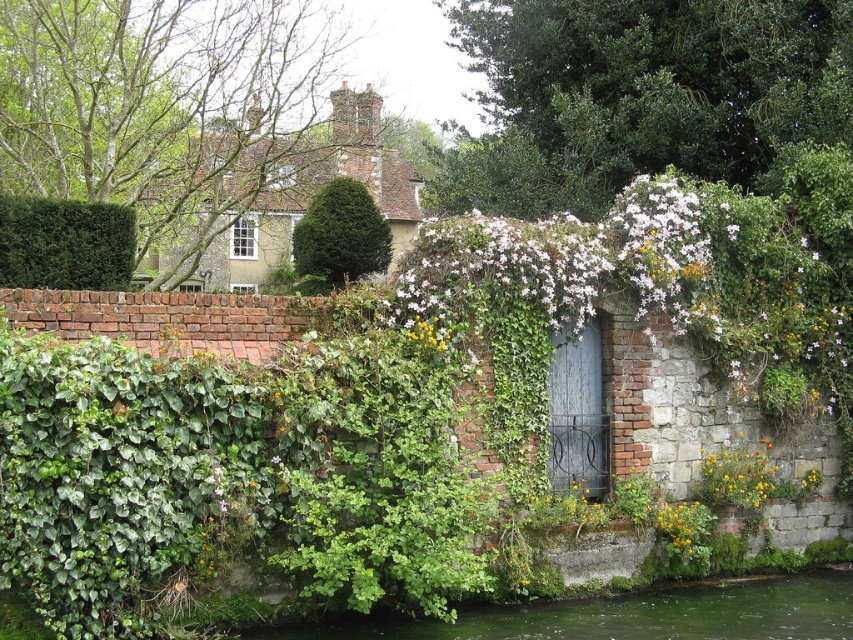
Question: Observing the image, what is the correct spatial positioning of white matte flowers at center in reference to green mossy stone at lower center?

Choices:
 (A) right
 (B) left

Answer: (B)

Question: Can you confirm if white matte flowers at center is bigger than green mossy stone at lower center?

Choices:
 (A) yes
 (B) no

Answer: (A)

Question: Which point appears farthest from the camera in this image?

Choices:
 (A) (326, 195)
 (B) (496, 612)
 (C) (723, 472)
 (D) (799, 284)

Answer: (A)

Question: Is white matte flowers at center above green leafy bush at upper left?

Choices:
 (A) yes
 (B) no

Answer: (B)

Question: Estimate the real-world distances between objects in this image. Which object is closer to the green leafy bush at upper left?

Choices:
 (A) white matte flowers at center
 (B) green textured hedge at center

Answer: (A)

Question: Which point appears farthest from the camera in this image?

Choices:
 (A) (834, 326)
 (B) (102, 212)
 (C) (672, 547)
 (D) (737, 465)

Answer: (B)